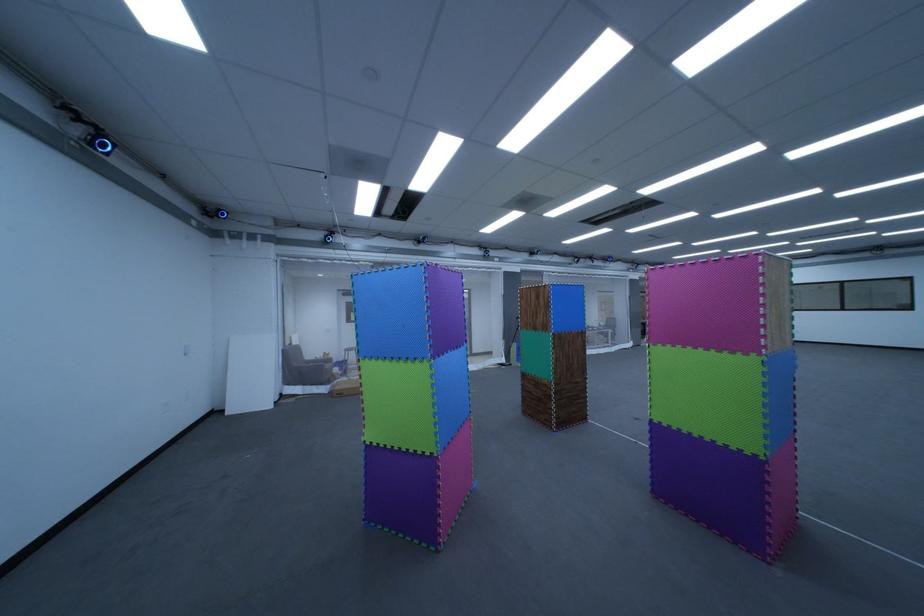
You are a GUI agent. You are given a task and a screenshot of the screen. Output one action in this format:
    pyautogui.click(x=<x>, y=<y>)
    Task: Click on the blue foam tile
    
    Given the screenshot: What is the action you would take?
    pyautogui.click(x=391, y=313)